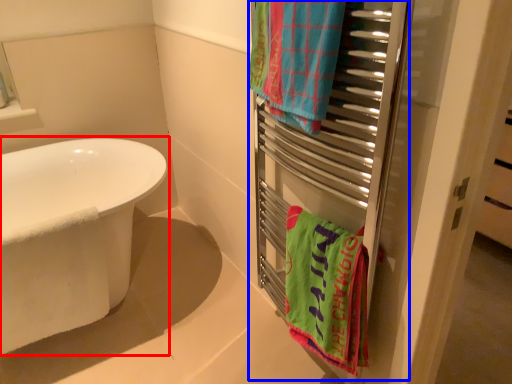
Question: Among these objects, which one is farthest to the camera, bathtub (highlighted by a red box) or closet (highlighted by a blue box)?

Choices:
 (A) bathtub
 (B) closet

Answer: (A)